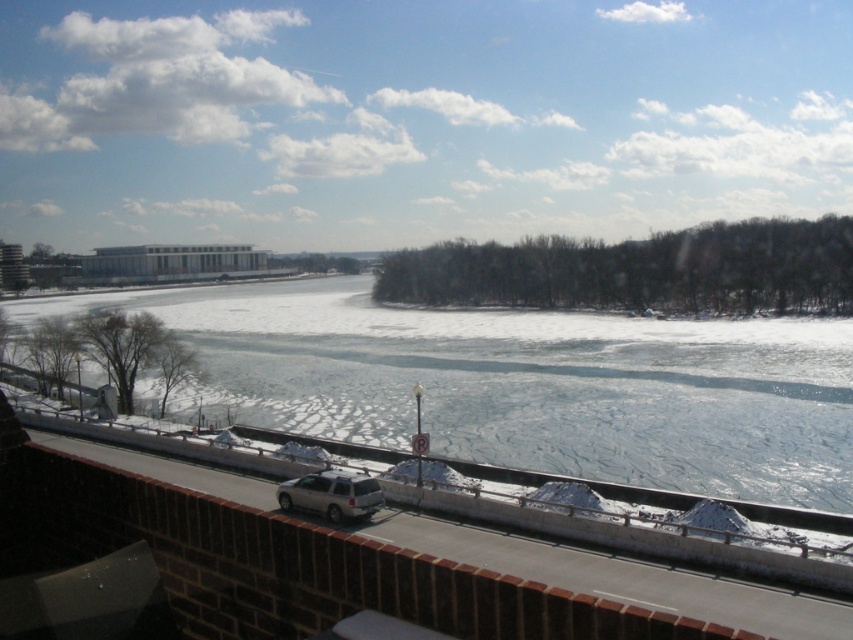
Question: Does frozen ice at center have a larger size compared to silver metallic suv at center?

Choices:
 (A) yes
 (B) no

Answer: (A)

Question: Which object appears farthest from the camera in this image?

Choices:
 (A) silver metallic suv at center
 (B) frozen ice at center

Answer: (B)

Question: Can you confirm if frozen ice at center is wider than silver metallic suv at center?

Choices:
 (A) yes
 (B) no

Answer: (A)

Question: Observing the image, what is the correct spatial positioning of frozen ice at center in reference to silver metallic suv at center?

Choices:
 (A) above
 (B) below

Answer: (A)